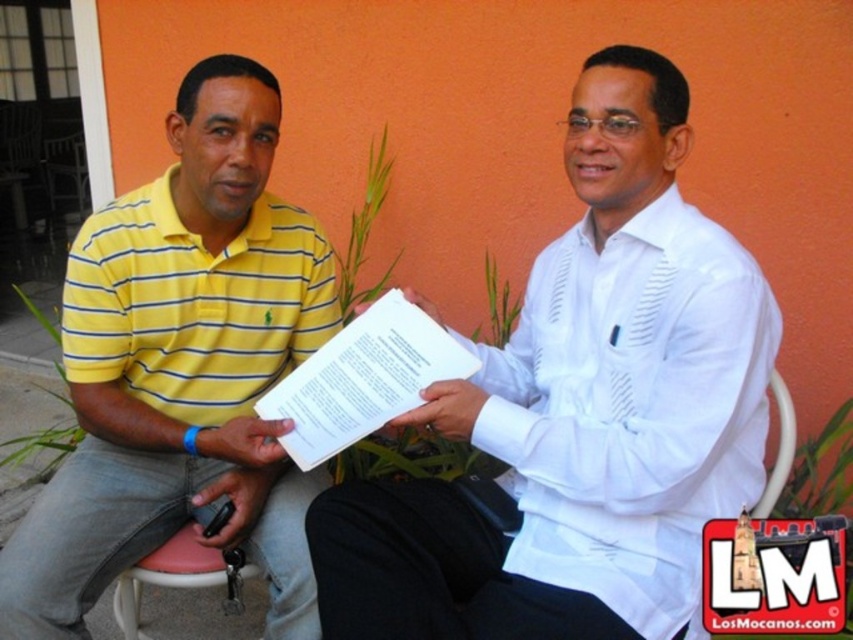
You are a photographer setting up for a group photo. You notice the yellow striped polo shirt at left and the pink plastic chair at lower left in the frame. Which object is closer to the camera?

The yellow striped polo shirt at left is closer to the camera because it is in front of the pink plastic chair at lower left.

You are a photographer setting up for a group photo. You notice the white textured shirt at center and the yellow striped polo shirt at left. Which person should you ask to stand on a stool to ensure both are at eye level?

The white textured shirt at center has a lesser height compared to yellow striped polo shirt at left, so you should ask the person wearing the white textured shirt at center to stand on a stool to balance their heights.

You are a photographer trying to capture a photo of the yellow striped polo shirt at left and the white paper at center. To ensure both are in frame, where should you position your camera relative to the scene?

The yellow striped polo shirt at left is to the left of the white paper at center, so position the camera to the right side of the scene to include both objects in the frame.